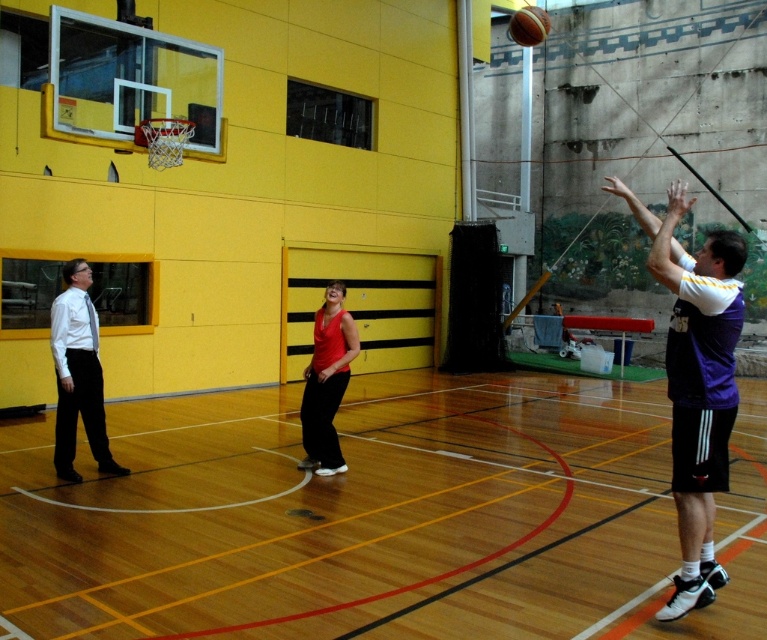
Consider the image. You are a basketball player standing on the wooden floor at center. You want to pass the ball to the teammate wearing the white shirt at left. Which direction should you pass the ball to reach them?

The wooden floor at center is larger in size than white shirt at left. You should pass the ball to the left direction to reach the teammate wearing the white shirt at left.

You are standing in the gymnasium and want to walk towards the wooden floor at center and the white shirt at left. Which object will you reach first?

The wooden floor at center is closer to the viewer than the white shirt at left, so you will reach the wooden floor at center first.

You are a photographer standing at the back of the gymnasium and want to capture a photo of the matte red tank top at center and the rubber textured basketball at upper center. Which object should you focus on first if you want to prioritize the one closer to you?

The rubber textured basketball at upper center is closer to you than the matte red tank top at center, so you should focus on the rubber textured basketball at upper center first.